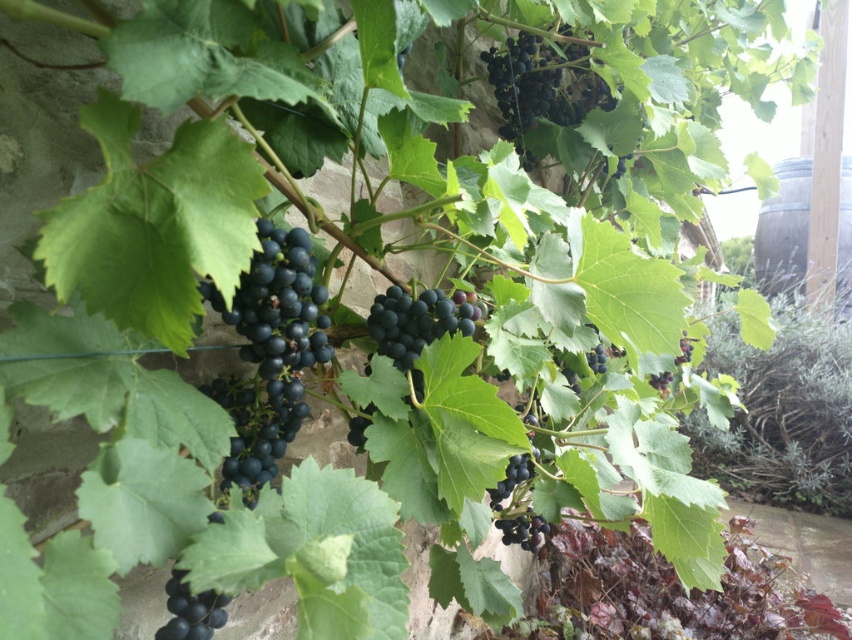
Question: Does dark purple grapes at upper center appear on the left side of shiny dark blue grapes at center?

Choices:
 (A) no
 (B) yes

Answer: (A)

Question: Which point appears farthest from the camera in this image?

Choices:
 (A) (519, 134)
 (B) (455, 307)
 (C) (274, 312)
 (D) (684, 342)

Answer: (D)

Question: Considering the real-world distances, which object is farthest from the shiny dark purple grapes at center?

Choices:
 (A) shiny dark purple grapes at center-right
 (B) dark purple grapes at center
 (C) black matte grapes at lower left

Answer: (C)

Question: Can you confirm if black matte grapes at lower left is positioned to the right of shiny dark purple grapes at center-right?

Choices:
 (A) no
 (B) yes

Answer: (A)

Question: Does dark purple grapes at upper center appear on the right side of shiny dark blue grapes at center?

Choices:
 (A) no
 (B) yes

Answer: (B)

Question: Considering the real-world distances, which object is farthest from the dark purple grapes at upper center?

Choices:
 (A) shiny dark purple grapes at center-right
 (B) shiny dark blue grapes at center

Answer: (B)